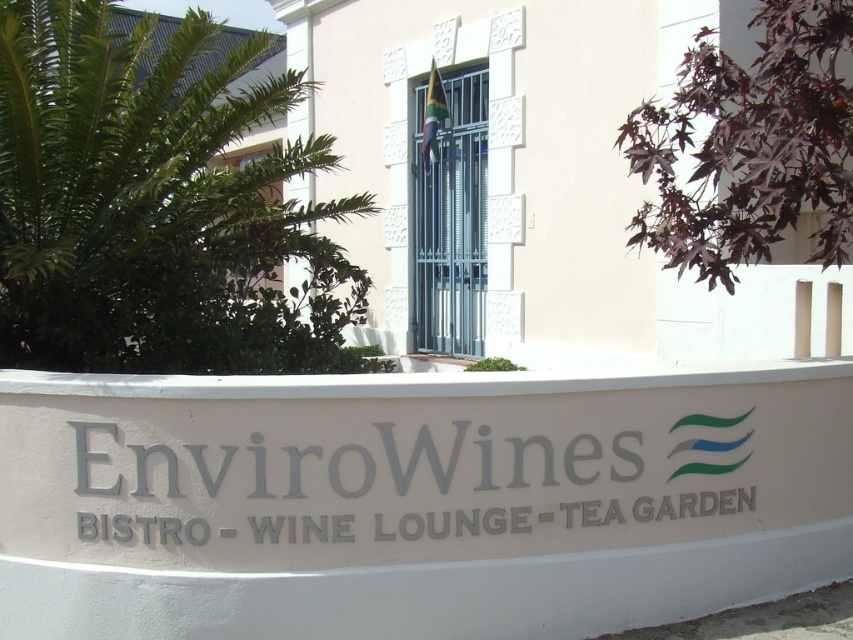
Question: Does gray metallic sign at center appear on the right side of metallic gate at center?

Choices:
 (A) no
 (B) yes

Answer: (A)

Question: Which point appears closest to the camera in this image?

Choices:
 (A) (699, 468)
 (B) (485, 262)

Answer: (A)

Question: Which of the following is the farthest from the observer?

Choices:
 (A) (480, 237)
 (B) (685, 508)

Answer: (A)

Question: Is gray metallic sign at center positioned before metallic gate at center?

Choices:
 (A) no
 (B) yes

Answer: (B)

Question: Is gray metallic sign at center to the left of metallic gate at center from the viewer's perspective?

Choices:
 (A) no
 (B) yes

Answer: (B)

Question: Among these objects, which one is farthest from the camera?

Choices:
 (A) gray metallic sign at center
 (B) metallic gate at center

Answer: (B)